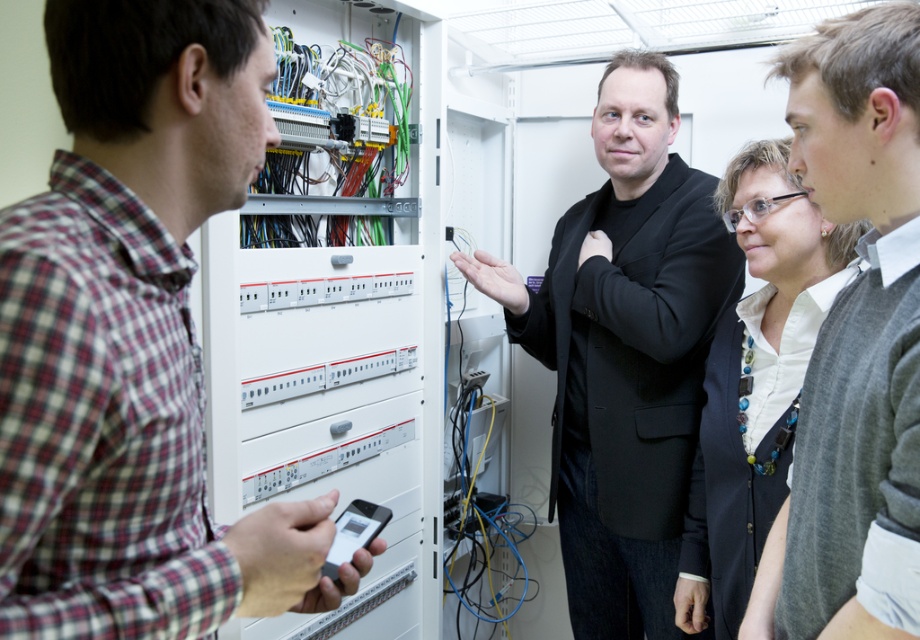
You are a maintenance worker who needs to hand a tool to both the plaid cotton shirt at left and the black matte suit at center. If your reach is 1 meter, can you pass the tool to both individuals without moving?

The plaid cotton shirt at left and black matte suit at center are 1.23 meters apart from each other. Since your reach is only 1 meter, you cannot reach both individuals at the same time without moving closer to them.

You are standing in front of the electrical panel and need to locate the person wearing the plaid cotton shirt at left. Based on the coordinates provided, where exactly should you look to find them?

The plaid cotton shirt at left is located at point coordinates [134,339].

You are an event planner organizing a photoshoot in the scene described. You need to position two models wearing the black matte suit at center and the gray sweater at center so that they can both be clearly visible in the photo. Considering their sizes, which model should you place closer to the camera to ensure both are visible without one blocking the other?

The black matte suit at center is wider than the gray sweater at center. To ensure both are visible, place the wider black matte suit at center closer to the camera so it doesn